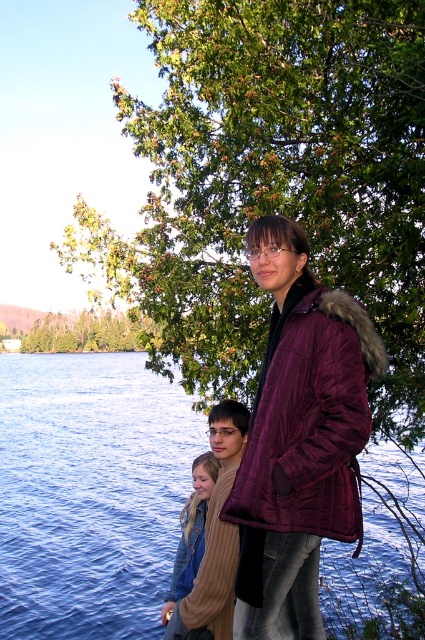
You are standing in the scene and want to walk from point A to point B. Point A is at coordinates point (104, 460) and point B is at coordinates point (226, 424). Which direction should you move to get closer to point B?

You should move away from the viewer because point (104, 460) is closer to the viewer than point (226, 424). Moving away from the viewer will take you towards point B.

In the scene, there is a green leafy tree at upper center and a maroon quilted jacket at center. Which object is wider?

The green leafy tree at upper center is wider than the maroon quilted jacket at center.

Based on the photo, you are a photographer standing at the edge of the lake. You want to take a photo that includes both the green leafy tree at upper center and the maroon quilted jacket at center. Given that your camera has a maximum focus range of 3 meters, will both subjects be in focus?

The green leafy tree at upper center is 2.81 meters away from the maroon quilted jacket at center. Since the distance between them is within the camera maximum focus range of 3 meters, both subjects will be in focus.